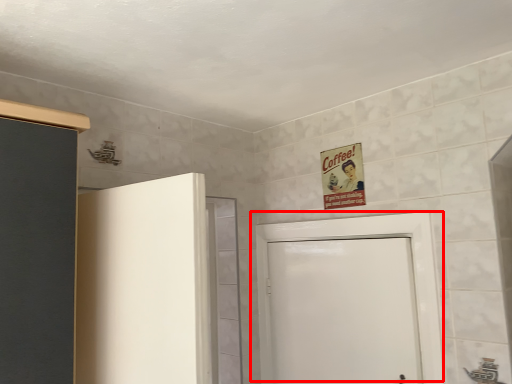
Question: From the image's perspective, what is the correct spatial positioning of door (annotated by the red box) in reference to poster?

Choices:
 (A) below
 (B) above

Answer: (A)